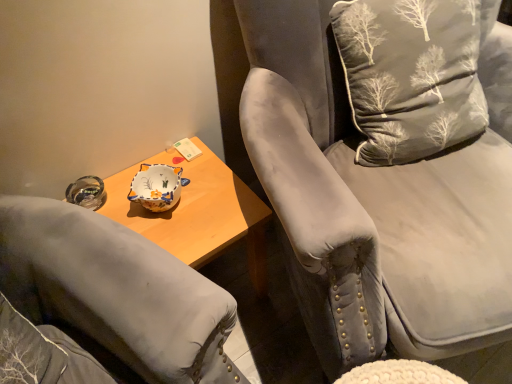
Describe the element at coordinates (413, 74) in the screenshot. I see `silvery fabric cushion at upper right` at that location.

The width and height of the screenshot is (512, 384). I want to click on silvery fabric cushion at upper right, so click(413, 74).

Describe the element at coordinates (385, 170) in the screenshot. I see `velvet gray chair at upper right` at that location.

Locate an element on the screen. velvet gray chair at upper right is located at coordinates (385, 170).

I want to click on silvery fabric cushion at upper right, so click(413, 74).

Which object is positioned more to the left, velvet gray chair at upper right or silvery fabric cushion at upper right?

From the viewer's perspective, silvery fabric cushion at upper right appears more on the left side.

Considering the positions of objects velvet gray chair at upper right and silvery fabric cushion at upper right in the image provided, who is behind, velvet gray chair at upper right or silvery fabric cushion at upper right?

Positioned behind is silvery fabric cushion at upper right.

Is point (426, 147) less distant than point (400, 161)?

Yes, point (426, 147) is in front of point (400, 161).

From the image's perspective, is velvet gray chair at upper right on silvery fabric cushion at upper right?

No, from the image's perspective, velvet gray chair at upper right is not over silvery fabric cushion at upper right.

From a real-world perspective, which object stands above the other?

silvery fabric cushion at upper right.

Considering the relative sizes of velvet gray chair at upper right and silvery fabric cushion at upper right in the image provided, is velvet gray chair at upper right wider than silvery fabric cushion at upper right?

Yes, velvet gray chair at upper right is wider than silvery fabric cushion at upper right.

Considering the sizes of velvet gray chair at upper right and silvery fabric cushion at upper right in the image, is velvet gray chair at upper right taller or shorter than silvery fabric cushion at upper right?

Clearly, velvet gray chair at upper right is taller compared to silvery fabric cushion at upper right.

Does velvet gray chair at upper right have a smaller size compared to silvery fabric cushion at upper right?

Incorrect, velvet gray chair at upper right is not smaller in size than silvery fabric cushion at upper right.

Is velvet gray chair at upper right not inside silvery fabric cushion at upper right?

Yes, velvet gray chair at upper right is located beyond the bounds of silvery fabric cushion at upper right.

Are velvet gray chair at upper right and silvery fabric cushion at upper right located far from each other?

That's not correct — velvet gray chair at upper right is a little close to silvery fabric cushion at upper right.

Is velvet gray chair at upper right positioned with its back to silvery fabric cushion at upper right?

Yes, velvet gray chair at upper right is positioned with its back facing silvery fabric cushion at upper right.

Find the location of `chair below the silvery fabric cushion at upper right (from a real-world perspective)`. chair below the silvery fabric cushion at upper right (from a real-world perspective) is located at coordinates (385, 170).

Which is more to the left, silvery fabric cushion at upper right or velvet gray chair at upper right?

From the viewer's perspective, silvery fabric cushion at upper right appears more on the left side.

Which object is more forward, silvery fabric cushion at upper right or velvet gray chair at upper right?

velvet gray chair at upper right is closer to the camera.

Which is in front, point (419, 25) or point (344, 75)?

The point (419, 25) is in front.

From the image's perspective, relative to velvet gray chair at upper right, is silvery fabric cushion at upper right above or below?

Based on their image positions, silvery fabric cushion at upper right is located above velvet gray chair at upper right.

From a real-world perspective, which object stands above the other?

From a 3D spatial view, silvery fabric cushion at upper right is above.

Is silvery fabric cushion at upper right wider than velvet gray chair at upper right?

No, silvery fabric cushion at upper right is not wider than velvet gray chair at upper right.

Considering the relative sizes of silvery fabric cushion at upper right and velvet gray chair at upper right in the image provided, is silvery fabric cushion at upper right shorter than velvet gray chair at upper right?

Indeed, silvery fabric cushion at upper right has a lesser height compared to velvet gray chair at upper right.

Which of these two, silvery fabric cushion at upper right or velvet gray chair at upper right, is bigger?

velvet gray chair at upper right is bigger.

Would you say silvery fabric cushion at upper right is outside velvet gray chair at upper right?

No.

Is silvery fabric cushion at upper right next to velvet gray chair at upper right and touching it?

Yes, silvery fabric cushion at upper right is beside velvet gray chair at upper right.

Consider the image. Is velvet gray chair at upper right at the back of silvery fabric cushion at upper right?

Yes, velvet gray chair at upper right is at the back of silvery fabric cushion at upper right.

How much distance is there between silvery fabric cushion at upper right and velvet gray chair at upper right?

A distance of 3.43 inches exists between silvery fabric cushion at upper right and velvet gray chair at upper right.

The image size is (512, 384). In order to click on throw pillow above the velvet gray chair at upper right (from a real-world perspective) in this screenshot , I will do `click(413, 74)`.

Find the location of a particular element. Image resolution: width=512 pixels, height=384 pixels. chair lying in front of the silvery fabric cushion at upper right is located at coordinates (385, 170).

The image size is (512, 384). What are the coordinates of `throw pillow located on the left of velvet gray chair at upper right` in the screenshot? It's located at tap(413, 74).